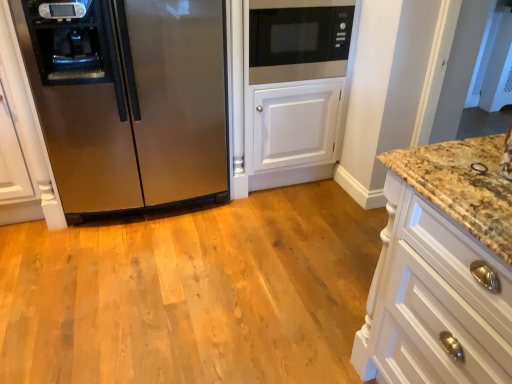
Question: From a real-world perspective, is black matte microwave at upper center located higher than white wood cabinet at right?

Choices:
 (A) yes
 (B) no

Answer: (A)

Question: From a real-world perspective, is black matte microwave at upper center located beneath white wood cabinet at right?

Choices:
 (A) no
 (B) yes

Answer: (A)

Question: Is black matte microwave at upper center aimed at white wood cabinet at right?

Choices:
 (A) no
 (B) yes

Answer: (B)

Question: Could white wood cabinet at right be considered to be inside black matte microwave at upper center?

Choices:
 (A) yes
 (B) no

Answer: (B)

Question: Considering the relative sizes of black matte microwave at upper center and white wood cabinet at right in the image provided, is black matte microwave at upper center thinner than white wood cabinet at right?

Choices:
 (A) no
 (B) yes

Answer: (B)

Question: Can we say black matte microwave at upper center lies outside white wood cabinet at right?

Choices:
 (A) no
 (B) yes

Answer: (B)

Question: Considering the relative sizes of white wood cabinet at right and stainless steel refrigerator at left in the image provided, is white wood cabinet at right bigger than stainless steel refrigerator at left?

Choices:
 (A) yes
 (B) no

Answer: (B)

Question: Can you confirm if white wood cabinet at right is thinner than stainless steel refrigerator at left?

Choices:
 (A) yes
 (B) no

Answer: (B)

Question: Does white wood cabinet at right appear on the right side of stainless steel refrigerator at left?

Choices:
 (A) no
 (B) yes

Answer: (B)

Question: Does white wood cabinet at right have a lesser height compared to stainless steel refrigerator at left?

Choices:
 (A) yes
 (B) no

Answer: (A)

Question: From the image's perspective, would you say white wood cabinet at right is shown under stainless steel refrigerator at left?

Choices:
 (A) yes
 (B) no

Answer: (A)

Question: From a real-world perspective, is white wood cabinet at right physically below stainless steel refrigerator at left?

Choices:
 (A) yes
 (B) no

Answer: (A)

Question: From a real-world perspective, is stainless steel refrigerator at left positioned under white wood cabinet at right based on gravity?

Choices:
 (A) no
 (B) yes

Answer: (A)